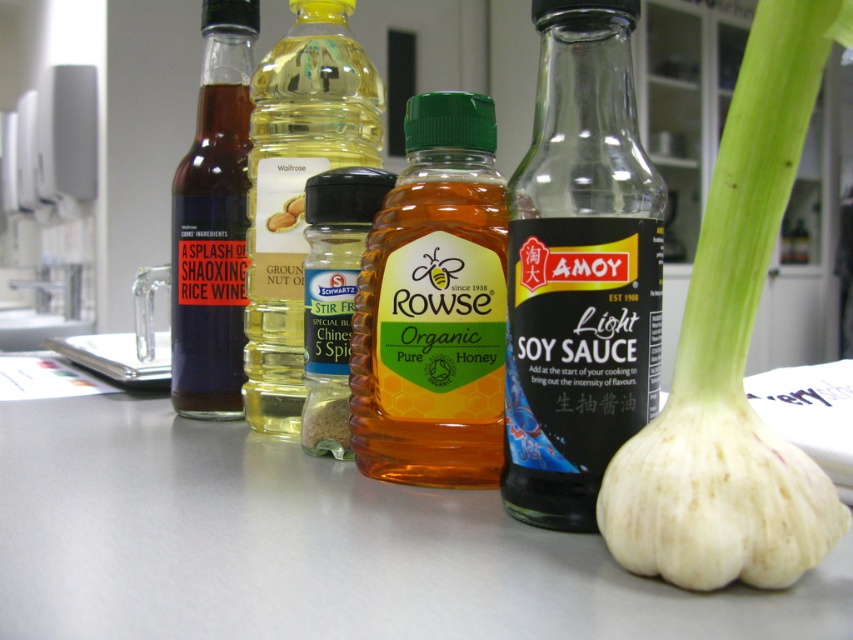
Which is in front, point (350, 458) or point (277, 227)?

Point (350, 458) is in front.

Who is positioned more to the right, translucent amber honey jar at center or ground nut oil at center?

From the viewer's perspective, translucent amber honey jar at center appears more on the right side.

Does point (335, 452) come behind point (276, 227)?

No, (335, 452) is closer to viewer.

Find the location of a particular element. This screenshot has height=640, width=853. translucent amber honey jar at center is located at coordinates (334, 296).

You are a GUI agent. You are given a task and a screenshot of the screen. Output one action in this format:
    pyautogui.click(x=<x>, y=<y>)
    Task: Click on the matte glass bottle of shaoxing rice wine at left
    
    Given the screenshot: What is the action you would take?
    pyautogui.click(x=213, y=221)

Which is in front, point (173, 362) or point (281, 218)?

Positioned in front is point (281, 218).

Image resolution: width=853 pixels, height=640 pixels. Identify the location of matte glass bottle of shaoxing rice wine at left. (213, 221).

Is white papery garlic at center to the left of ground nut oil at center from the viewer's perspective?

Incorrect, white papery garlic at center is not on the left side of ground nut oil at center.

Is point (664, 579) farther from viewer compared to point (293, 198)?

No, (664, 579) is closer to viewer.

Where is `white papery garlic at center`? Image resolution: width=853 pixels, height=640 pixels. white papery garlic at center is located at coordinates (733, 353).